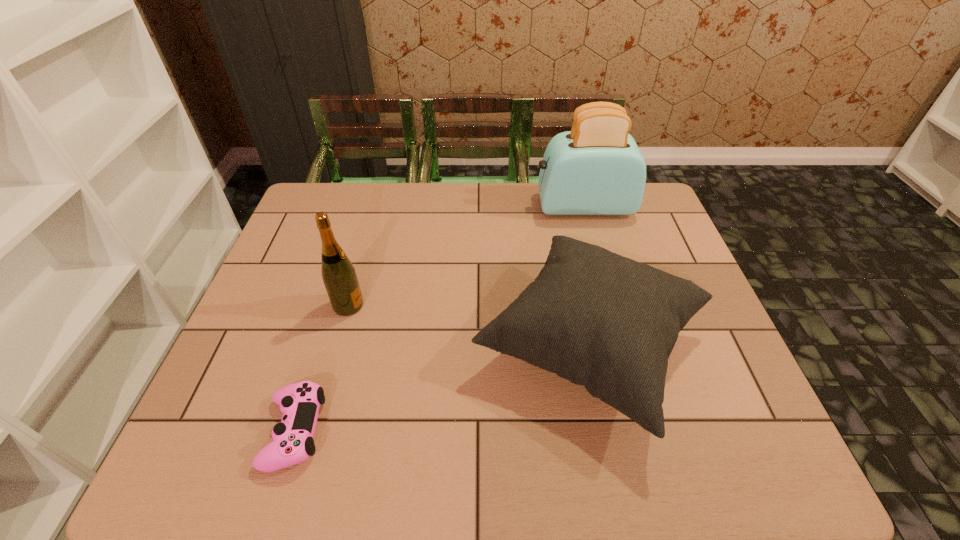
Find the location of a particular element. This screenshot has height=540, width=960. blank region between the shortest object and the cushion is located at coordinates (442, 389).

I want to click on vacant area that lies between the wine bottle and the control, so click(322, 368).

Identify the location of free space between the control and the toaster. Image resolution: width=960 pixels, height=540 pixels. (439, 319).

You are a GUI agent. You are given a task and a screenshot of the screen. Output one action in this format:
    pyautogui.click(x=<x>, y=<y>)
    Task: Click on the closest object relative to the toaster
    The image size is (960, 540).
    Given the screenshot: What is the action you would take?
    pyautogui.click(x=601, y=320)

Locate an element on the screen. Image resolution: width=960 pixels, height=540 pixels. object identified as the closest to the toaster is located at coordinates (601, 320).

The image size is (960, 540). I want to click on vacant area that satisfies the following two spatial constraints: 1. on the front-facing side of the cushion; 2. on the right side of the wine bottle, so click(x=337, y=347).

The height and width of the screenshot is (540, 960). In order to click on free space that satisfies the following two spatial constraints: 1. on the front-facing side of the second shortest object; 2. on the left side of the wine bottle in this screenshot , I will do `click(337, 347)`.

At what (x,y) coordinates should I click in order to perform the action: click on free space that satisfies the following two spatial constraints: 1. on the side of the farthest object with the lever; 2. on the front side of the third tallest object. Please return your answer as a coordinate pair (x, y). Image resolution: width=960 pixels, height=540 pixels. Looking at the image, I should click on (623, 347).